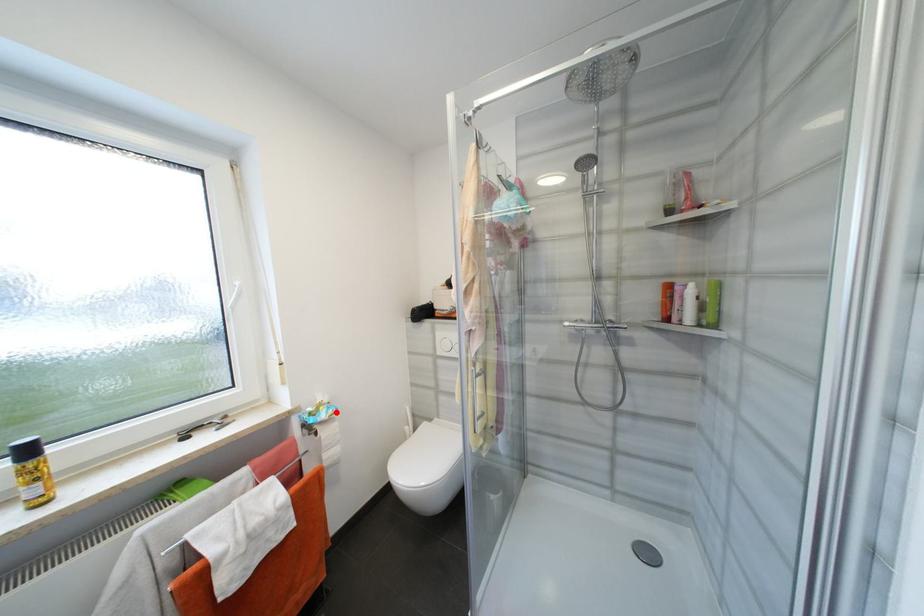
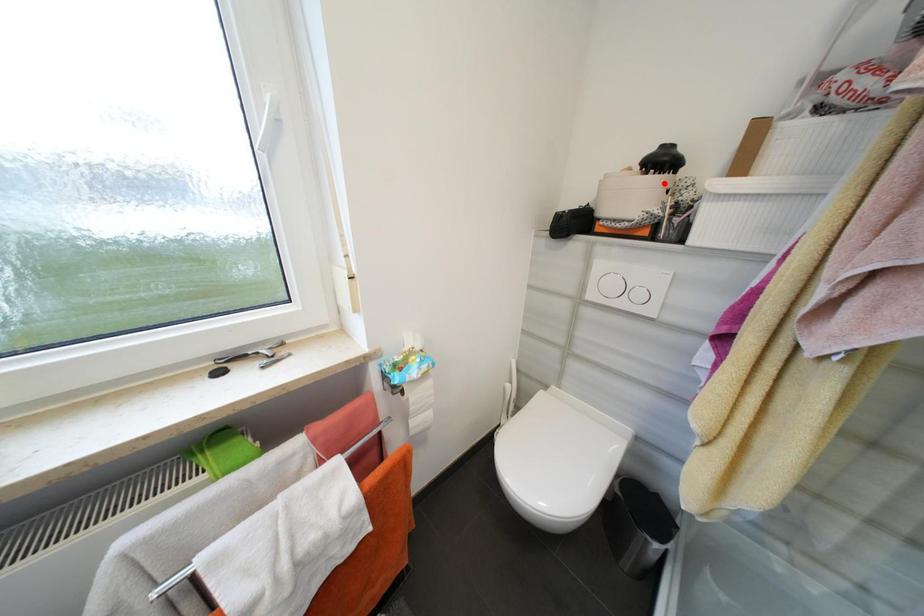
I am providing you with two images of the same scene from different viewpoints. A red point is marked on the first image and another point is marked on the second image. Do the highlighted points in image1 and image2 indicate the same real-world spot?

No